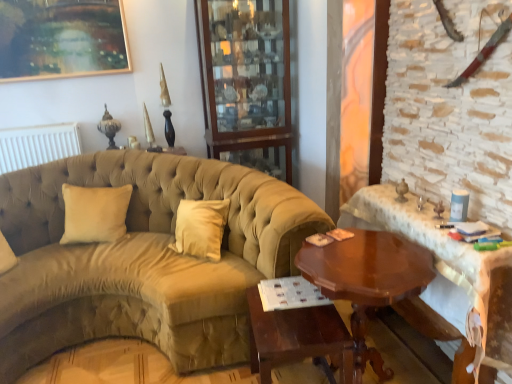
At what (x,y) coordinates should I click in order to perform the action: click on free spot above mahogany wood table at center, acting as the third table starting from the right (from a real-world perspective). Please return your answer as a coordinate pair (x, y). The image size is (512, 384). Looking at the image, I should click on (283, 303).